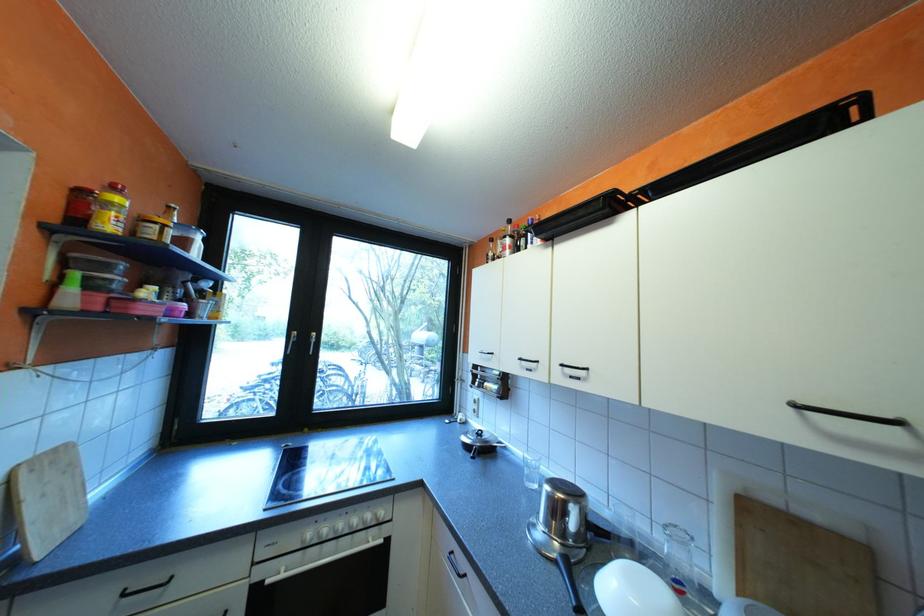
The height and width of the screenshot is (616, 924). In order to click on kettle handle in this screenshot , I will do `click(569, 583)`.